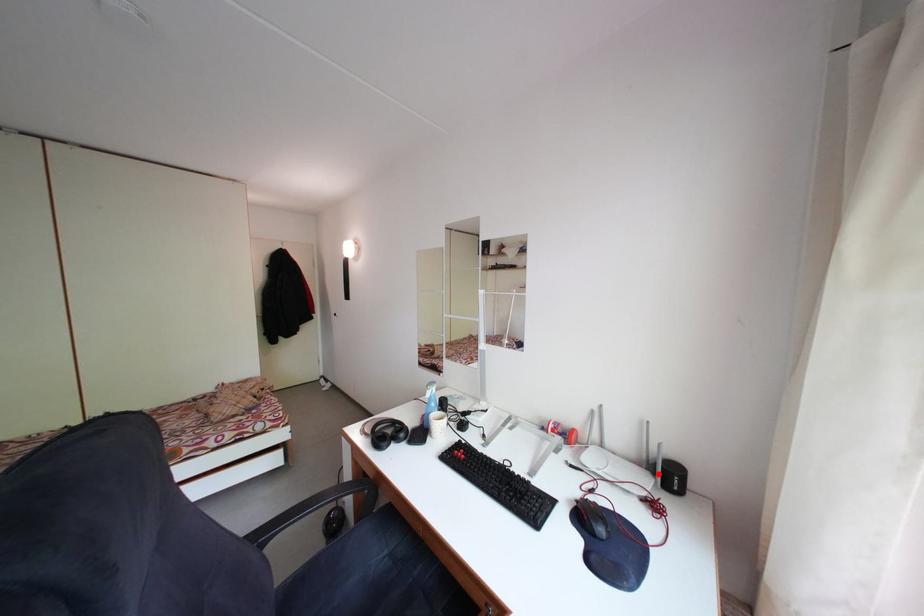
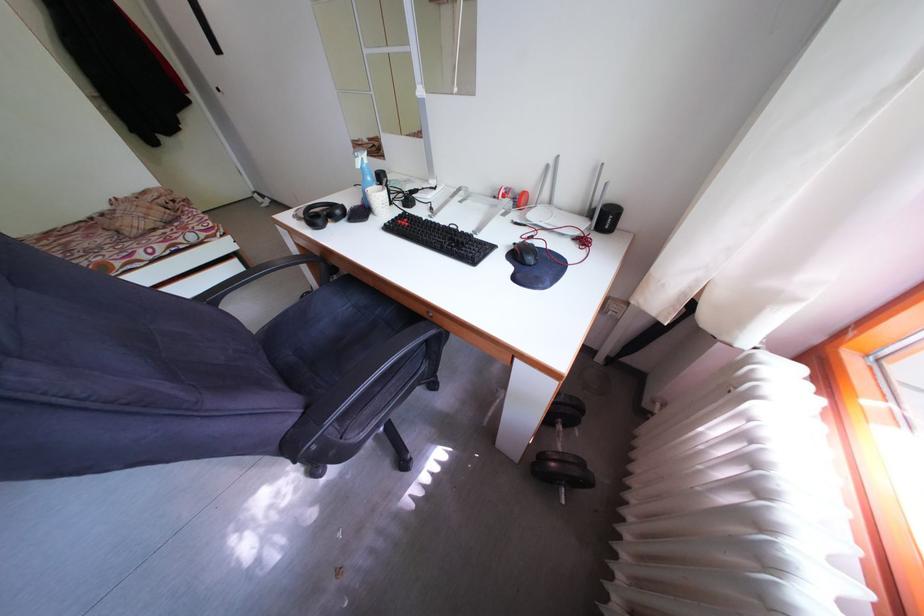
Question: I am providing you with two images of the same scene from different viewpoints. A red point is marked on the first image. Can you still see the location of the red point in image 2?

Choices:
 (A) Yes
 (B) No

Answer: (A)